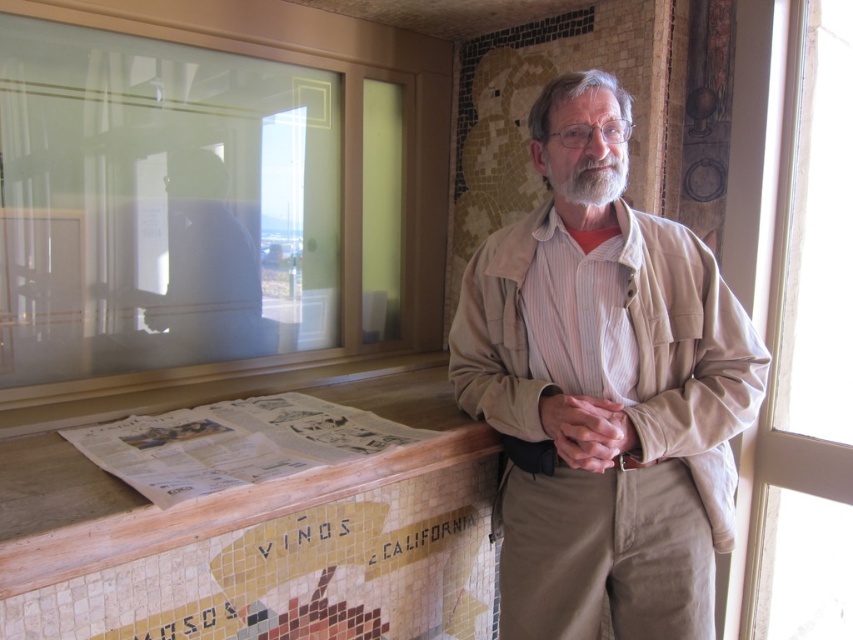
Does wooden at lower left have a lesser height compared to transparent glass window at right?

Indeed, wooden at lower left has a lesser height compared to transparent glass window at right.

Can you confirm if wooden at lower left is positioned to the left of transparent glass window at right?

Correct, you'll find wooden at lower left to the left of transparent glass window at right.

Between point (440, 556) and point (775, 77), which one is positioned behind?

The point (775, 77) is behind.

Locate an element on the screen. wooden at lower left is located at coordinates (260, 540).

Who is lower down, tan fabric jacket at center or wooden at lower left?

wooden at lower left

What do you see at coordinates (607, 417) in the screenshot? I see `tan fabric jacket at center` at bounding box center [607, 417].

The image size is (853, 640). In order to click on tan fabric jacket at center in this screenshot , I will do `click(607, 417)`.

Where is `tan fabric jacket at center`? This screenshot has height=640, width=853. tan fabric jacket at center is located at coordinates (607, 417).

Who is lower down, frosted glass window at upper left or tan fabric jacket at center?

tan fabric jacket at center

Describe the element at coordinates (212, 202) in the screenshot. This screenshot has height=640, width=853. I see `frosted glass window at upper left` at that location.

Is point (96, 257) behind point (624, 448)?

Yes, point (96, 257) is behind point (624, 448).

Identify the location of frosted glass window at upper left. (212, 202).